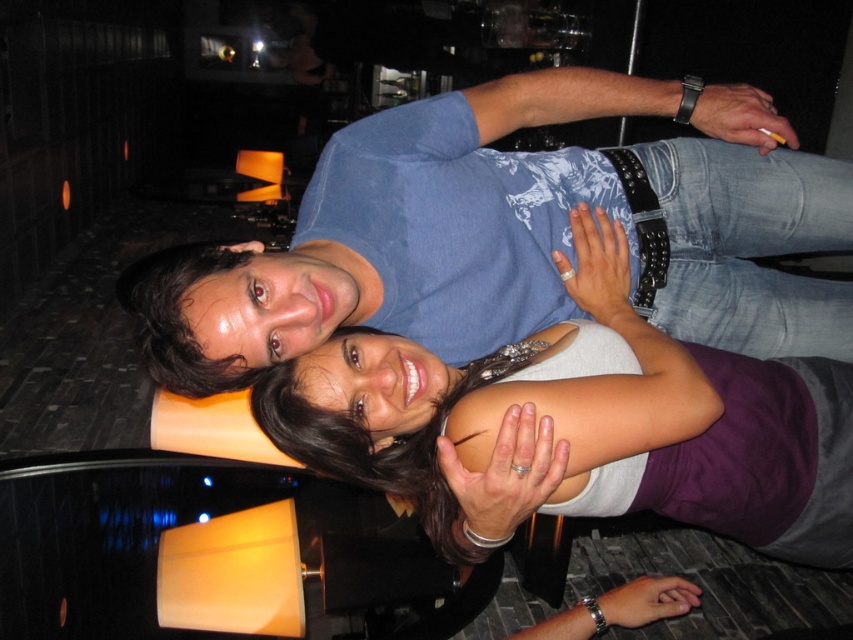
You are a photographer trying to capture a group photo of the blue cotton shirt at upper center and the matte white tank top at center. If you want to ensure both subjects are centered in the frame, which direction should you move the camera? Please provide your reasoning based on their positions.

The blue cotton shirt at upper center is to the left of the matte white tank top at center. To center both subjects in the frame, you should move the camera slightly to the left so that the blue cotton shirt at upper center shifts towards the center while the matte white tank top at center moves towards the right, balancing their positions.

You are a photographer adjusting the lighting for a photo shoot. You need to ensure that both the blue cotton shirt at upper center and the matte white tank top at center are evenly lit. Based on their positions, which shirt should you focus more light on to balance the exposure?

The blue cotton shirt at upper center might be wider than matte white tank top at center, so you should focus more light on the matte white tank top at center to balance the exposure.